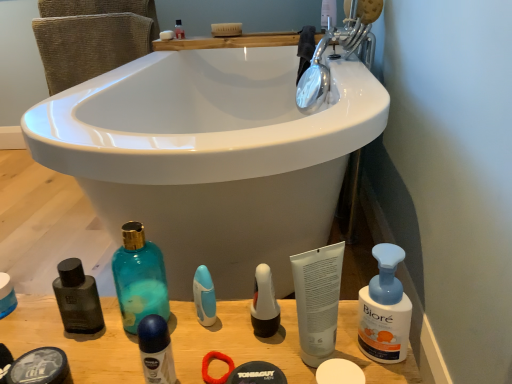
Image resolution: width=512 pixels, height=384 pixels. What are the coordinates of `vacant area that lies between blue matte deodorant at center, arranged as the fourth toiletry when viewed from the right, and white glossy pump bottle at center, the 4th toiletry from the bottom` in the screenshot? It's located at click(222, 348).